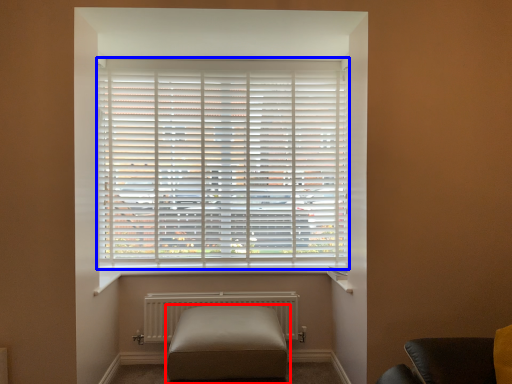
Question: Which object is closer to the camera taking this photo, furniture (highlighted by a red box) or window blind (highlighted by a blue box)?

Choices:
 (A) furniture
 (B) window blind

Answer: (A)